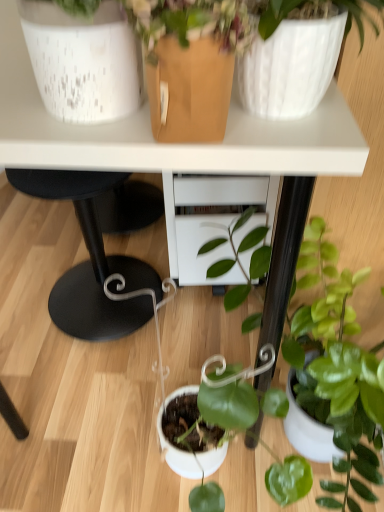
Question: Is white glossy table at upper center further to the viewer compared to green glossy plant at lower right?

Choices:
 (A) yes
 (B) no

Answer: (A)

Question: Would you say white glossy table at upper center is a long distance from green glossy plant at lower right?

Choices:
 (A) yes
 (B) no

Answer: (B)

Question: Is white glossy table at upper center to the left of green glossy plant at lower right from the viewer's perspective?

Choices:
 (A) yes
 (B) no

Answer: (A)

Question: Can you see white glossy table at upper center touching green glossy plant at lower right?

Choices:
 (A) no
 (B) yes

Answer: (A)

Question: From a real-world perspective, does white glossy table at upper center stand above green glossy plant at lower right?

Choices:
 (A) yes
 (B) no

Answer: (A)

Question: Is white speckled ceramic pot at upper left wider or thinner than green glossy plant at lower right?

Choices:
 (A) thin
 (B) wide

Answer: (A)

Question: From a real-world perspective, is white speckled ceramic pot at upper left physically located above or below green glossy plant at lower right?

Choices:
 (A) below
 (B) above

Answer: (B)

Question: Looking at the image, does white speckled ceramic pot at upper left seem bigger or smaller compared to green glossy plant at lower right?

Choices:
 (A) big
 (B) small

Answer: (B)

Question: Do you think white speckled ceramic pot at upper left is within green glossy plant at lower right, or outside of it?

Choices:
 (A) inside
 (B) outside

Answer: (B)

Question: Considering the positions of green glossy plant at lower right and white glossy table at upper center in the image, is green glossy plant at lower right bigger or smaller than white glossy table at upper center?

Choices:
 (A) small
 (B) big

Answer: (A)

Question: Is green glossy plant at lower right spatially inside white glossy table at upper center, or outside of it?

Choices:
 (A) outside
 (B) inside

Answer: (A)

Question: From a real-world perspective, is green glossy plant at lower right above or below white glossy table at upper center?

Choices:
 (A) above
 (B) below

Answer: (B)

Question: Is point tap(218, 414) closer or farther from the camera than point tap(213, 147)?

Choices:
 (A) closer
 (B) farther

Answer: (B)

Question: Looking at their shapes, would you say white glossy table at upper center is wider or thinner than white speckled ceramic pot at upper left?

Choices:
 (A) wide
 (B) thin

Answer: (A)

Question: Considering the positions of point (148, 150) and point (79, 81), is point (148, 150) closer or farther from the camera than point (79, 81)?

Choices:
 (A) farther
 (B) closer

Answer: (A)